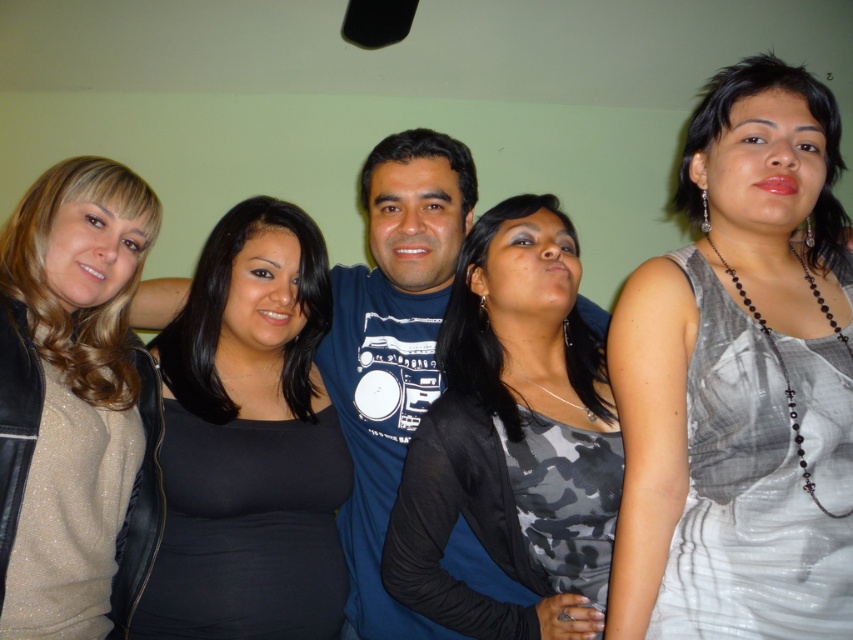
You are a photographer standing in front of the group. You want to take a photo of the gray textured dress at center and the camera on the man. Can you fit both in the frame if your camera has a 36 inch wide lens?

The gray textured dress at center and the camera are 36.47 inches apart. Since the distance between them exceeds the 36 inch lens width, the camera might not capture both in the same frame.

You are trying to decide which dress to choose between the gray textured dress at center and the camouflage fabric dress at center. Based on their widths, which one would you pick if you prefer a wider option?

The gray textured dress at center is wider than the camouflage fabric dress at center, so you should choose the gray textured dress at center if you prefer a wider option.

You are a photographer standing 2 meters away from the group. You want to take a closeup photo of the black matte shirt at center and the blue cotton shirt at center. Can you focus on both shirts clearly in the same photo?

The black matte shirt at center is 18.58 centimeters away from blue cotton shirt at center. Since the distance between them is relatively small, you can focus on both shirts clearly in the same photo.